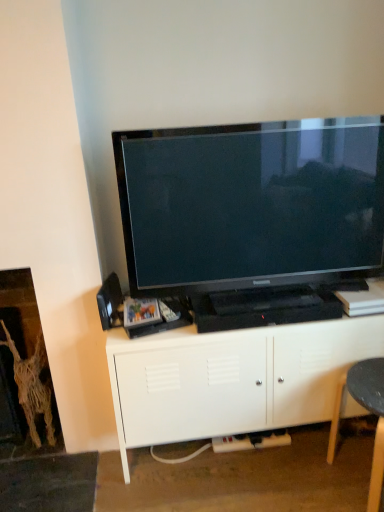
Question: From the image's perspective, is black plastic plug at lower center above black plastic swivel chair at lower right?

Choices:
 (A) no
 (B) yes

Answer: (A)

Question: Can you confirm if black plastic plug at lower center is shorter than black plastic swivel chair at lower right?

Choices:
 (A) no
 (B) yes

Answer: (B)

Question: Is the position of black plastic plug at lower center more distant than that of black plastic swivel chair at lower right?

Choices:
 (A) yes
 (B) no

Answer: (A)

Question: Is black plastic plug at lower center positioned in front of black plastic swivel chair at lower right?

Choices:
 (A) yes
 (B) no

Answer: (B)

Question: From a real-world perspective, is black plastic plug at lower center located beneath black plastic swivel chair at lower right?

Choices:
 (A) no
 (B) yes

Answer: (B)

Question: Considering the relative positions of black plastic plug at lower center and black plastic swivel chair at lower right in the image provided, is black plastic plug at lower center to the left of black plastic swivel chair at lower right from the viewer's perspective?

Choices:
 (A) yes
 (B) no

Answer: (A)

Question: Is white matte cabinet at center further to camera compared to black plastic plug at lower center?

Choices:
 (A) yes
 (B) no

Answer: (B)

Question: From the image's perspective, is white matte cabinet at center located above black plastic plug at lower center?

Choices:
 (A) no
 (B) yes

Answer: (B)

Question: Considering the relative sizes of white matte cabinet at center and black plastic plug at lower center in the image provided, is white matte cabinet at center wider than black plastic plug at lower center?

Choices:
 (A) no
 (B) yes

Answer: (B)

Question: Considering the relative sizes of white matte cabinet at center and black plastic plug at lower center in the image provided, is white matte cabinet at center thinner than black plastic plug at lower center?

Choices:
 (A) yes
 (B) no

Answer: (B)

Question: From a real-world perspective, is white matte cabinet at center on black plastic plug at lower center?

Choices:
 (A) yes
 (B) no

Answer: (A)

Question: Can you confirm if white matte cabinet at center is positioned to the left of black plastic plug at lower center?

Choices:
 (A) no
 (B) yes

Answer: (A)

Question: Is black plastic plug at lower center completely or partially outside of matte black tv at center?

Choices:
 (A) yes
 (B) no

Answer: (A)